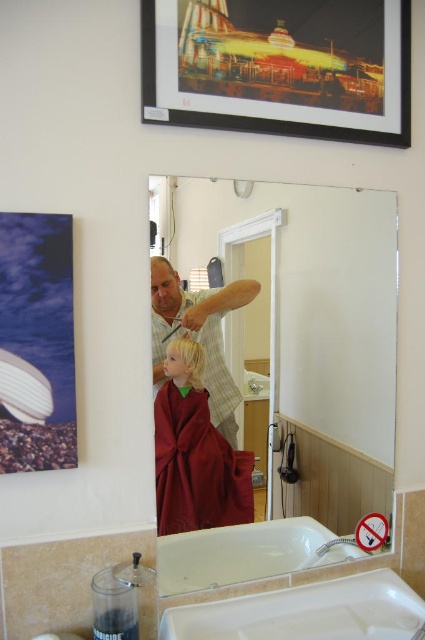
Question: Which of the following is the closest to the observer?

Choices:
 (A) (283, 205)
 (B) (178, 381)
 (C) (153, 268)

Answer: (C)

Question: Based on their relative distances, which object is nearer to the clear glass mirror at upper center?

Choices:
 (A) matte green shirt at center
 (B) blonde hair at center
 (C) white plastic sink at lower center

Answer: (A)

Question: Is white plastic sink at lower center in front of matte red cape at center?

Choices:
 (A) no
 (B) yes

Answer: (B)

Question: Does matte green shirt at center lie behind blonde hair at center?

Choices:
 (A) no
 (B) yes

Answer: (A)

Question: Does metallic framed poster at upper center come behind white plastic sink at lower center?

Choices:
 (A) yes
 (B) no

Answer: (B)

Question: Which of these objects is positioned closest to the blonde hair at upper center?

Choices:
 (A) blonde hair at center
 (B) white plastic sink at lower center
 (C) clear glass mirror at upper center
 (D) metallic framed poster at upper center

Answer: (A)